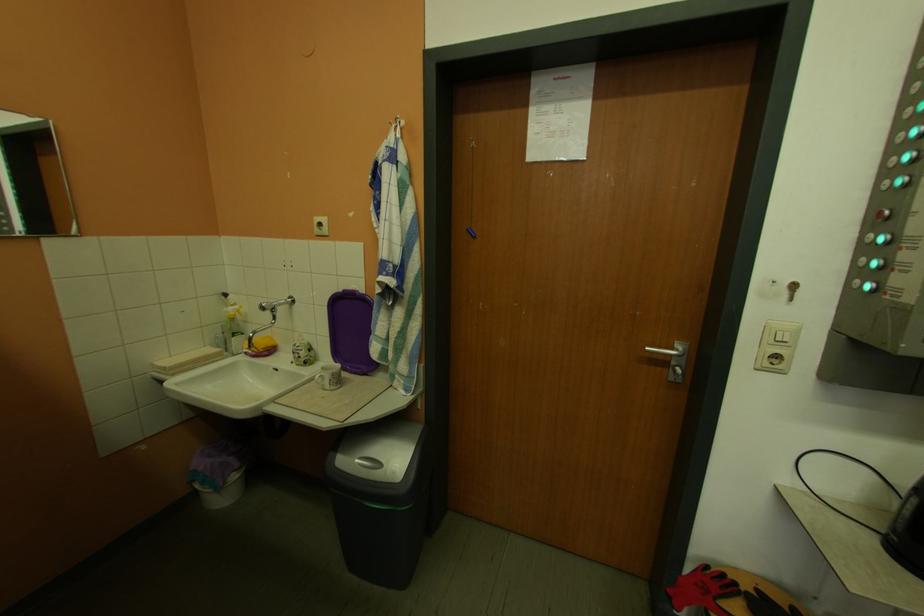
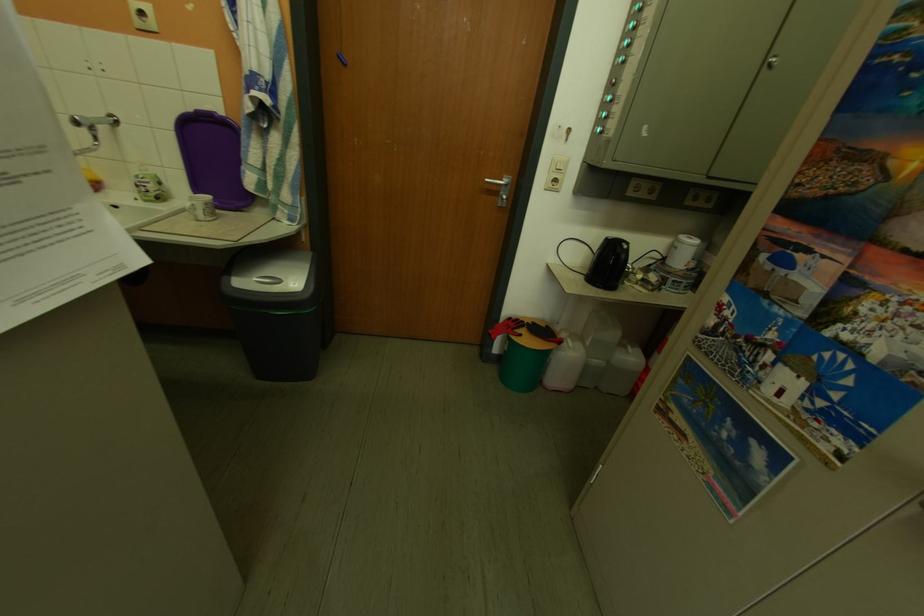
Locate, in the second image, the point that corresponds to the point at 344,456 in the first image.

(237, 280)